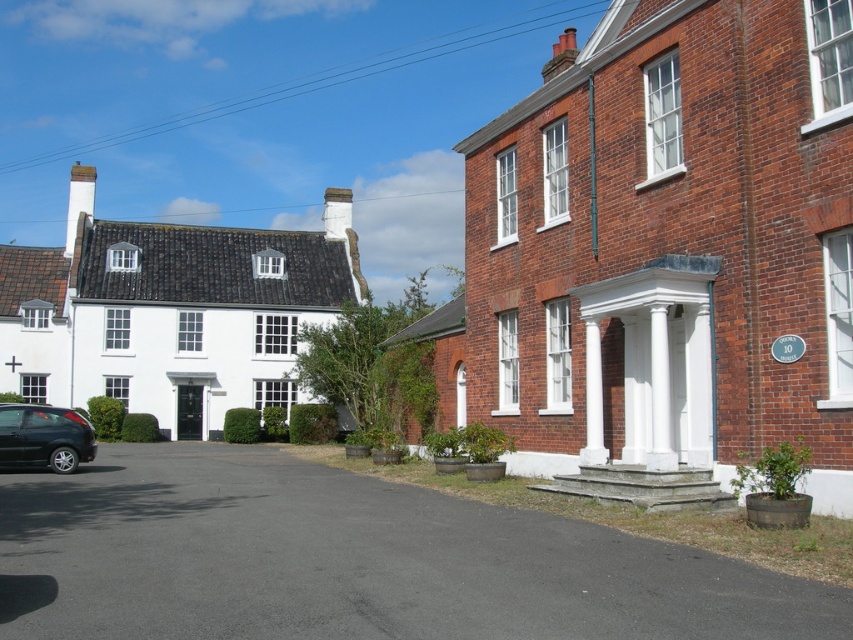
Question: Does black asphalt driveway at lower left appear on the left side of shiny black car at lower left?

Choices:
 (A) no
 (B) yes

Answer: (A)

Question: Which object appears closest to the camera in this image?

Choices:
 (A) black asphalt driveway at lower left
 (B) shiny black car at lower left

Answer: (A)

Question: Which object appears closest to the camera in this image?

Choices:
 (A) black asphalt driveway at lower left
 (B) shiny black car at lower left

Answer: (A)

Question: Observing the image, what is the correct spatial positioning of black asphalt driveway at lower left in reference to shiny black car at lower left?

Choices:
 (A) above
 (B) below

Answer: (B)

Question: From the image, what is the correct spatial relationship of black asphalt driveway at lower left in relation to shiny black car at lower left?

Choices:
 (A) right
 (B) left

Answer: (A)